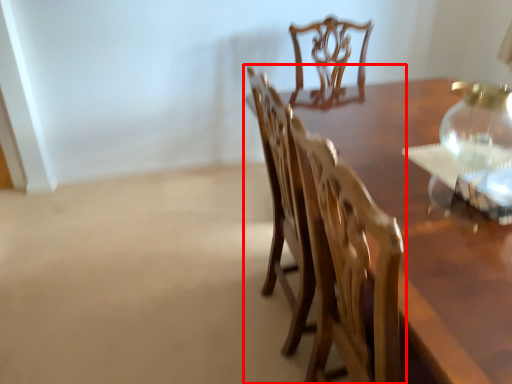
Question: Observing the image, what is the correct spatial positioning of chair (annotated by the red box) in reference to glass vase?

Choices:
 (A) left
 (B) right

Answer: (A)